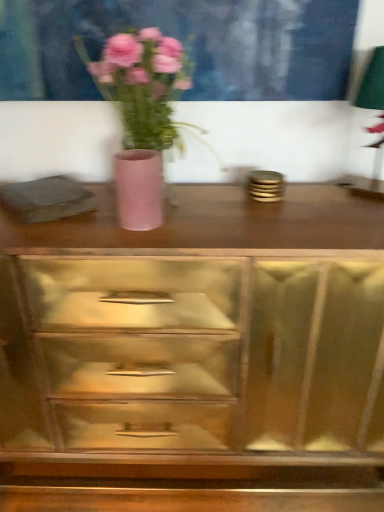
The width and height of the screenshot is (384, 512). Describe the element at coordinates (141, 115) in the screenshot. I see `pink matte vase at center` at that location.

Locate an element on the screen. matte pink vase at center is located at coordinates (139, 189).

Is matte pink vase at center a part of pink matte vase at center?

Indeed, matte pink vase at center is located within pink matte vase at center.

From the image's perspective, would you say pink matte vase at center is shown under matte pink vase at center?

Incorrect, from the image's perspective, pink matte vase at center is higher than matte pink vase at center.

Is pink matte vase at center thinner than matte pink vase at center?

No.

Which is correct: pink matte vase at center is inside wooden chest of drawers at center, or outside of it?

pink matte vase at center lies outside wooden chest of drawers at center.

From a real-world perspective, which object rests below the other?

wooden chest of drawers at center is physically lower.

Is pink matte vase at center closer to the viewer compared to wooden chest of drawers at center?

Yes, the depth of pink matte vase at center is less than that of wooden chest of drawers at center.

Is pink matte vase at center oriented away from wooden chest of drawers at center?

pink matte vase at center is not turned away from wooden chest of drawers at center.

Between point (272, 485) and point (118, 159), which one is positioned behind?

Positioned behind is point (272, 485).

Is wooden chest of drawers at center completely or partially outside of matte pink vase at center?

Yes.

Is the depth of wooden chest of drawers at center greater than that of pink matte vase at center?

Yes, it is.

Is wooden chest of drawers at center aimed at pink matte vase at center?

No, wooden chest of drawers at center is not aimed at pink matte vase at center.

Which of these two, wooden chest of drawers at center or pink matte vase at center, is wider?

Wider between the two is wooden chest of drawers at center.

Which is correct: wooden chest of drawers at center is inside pink matte vase at center, or outside of it?

Answer: wooden chest of drawers at center is spatially situated outside pink matte vase at center.

Based on the photo, from the image's perspective, would you say matte pink vase at center is shown under wooden chest of drawers at center?

No.

What's the angular difference between matte pink vase at center and wooden chest of drawers at center's facing directions?

The facing directions of matte pink vase at center and wooden chest of drawers at center are 2.4 degrees apart.

Does point (117, 203) appear closer or farther from the camera than point (270, 422)?

Point (117, 203) appears to be closer to the viewer than point (270, 422).

In the scene shown: How far apart are matte pink vase at center and wooden chest of drawers at center?

15.37 inches.

Between matte pink vase at center and pink matte vase at center, which one has more height?

Standing taller between the two is pink matte vase at center.

From the image's perspective, is matte pink vase at center located beneath pink matte vase at center?

Correct, matte pink vase at center appears lower than pink matte vase at center in the image.

Does matte pink vase at center turn towards pink matte vase at center?

No, matte pink vase at center is not oriented towards pink matte vase at center.

Find the location of a particular element. vase directly beneath the pink matte vase at center (from a real-world perspective) is located at coordinates (139, 189).

The height and width of the screenshot is (512, 384). In order to click on chest of drawers on the right of the pink matte vase at center in this screenshot , I will do `click(195, 356)`.

Looking at the image, which one is located further to wooden chest of drawers at center, matte pink vase at center or pink matte vase at center?

matte pink vase at center.

Looking at the image, which one is located further to pink matte vase at center, wooden chest of drawers at center or matte pink vase at center?

Among the two, wooden chest of drawers at center is located further to pink matte vase at center.

Estimate the real-world distances between objects in this image. Which object is closer to matte pink vase at center, pink matte vase at center or wooden chest of drawers at center?

Based on the image, pink matte vase at center appears to be nearer to matte pink vase at center.

Based on their spatial positions, is pink matte vase at center or matte pink vase at center further from wooden chest of drawers at center?

matte pink vase at center lies further to wooden chest of drawers at center than the other object.

Estimate the real-world distances between objects in this image. Which object is closer to pink matte vase at center, matte pink vase at center or wooden chest of drawers at center?

matte pink vase at center is closer to pink matte vase at center.

From the image, which object appears to be nearer to matte pink vase at center, wooden chest of drawers at center or pink matte vase at center?

pink matte vase at center is positioned closer to the anchor matte pink vase at center.

This screenshot has width=384, height=512. Identify the location of vase between pink matte vase at center and wooden chest of drawers at center in the up-down direction. (139, 189).